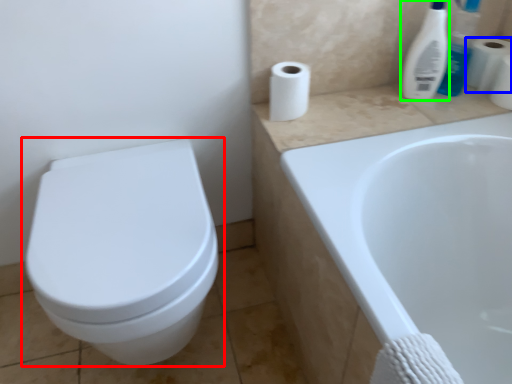
Question: Considering the real-world distances, which object is farthest from toilet (highlighted by a red box)? toilet paper (highlighted by a blue box) or cleaning product (highlighted by a green box)?

Choices:
 (A) toilet paper
 (B) cleaning product

Answer: (A)